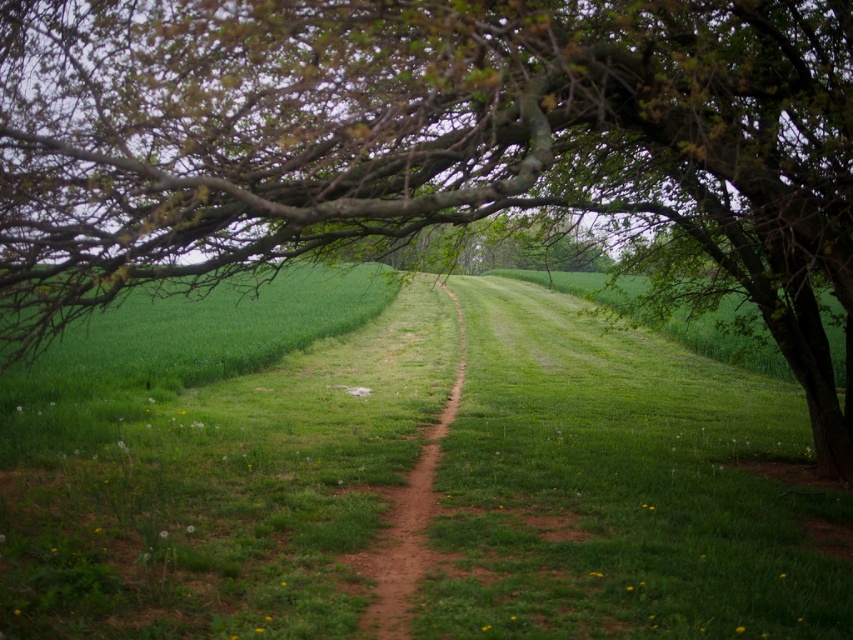
You are standing on the dirt path at center and want to walk towards the dense line of trees in the distance. Which direction should you go relative to the green grassy at center?

You should walk to the right of the green grassy at center because the dirt path at center leads towards the dense line of trees in the horizon, and the green grassy at center is to the left of the dirt path at center, so moving right relative to the grassy area would align you with the path leading to the trees.